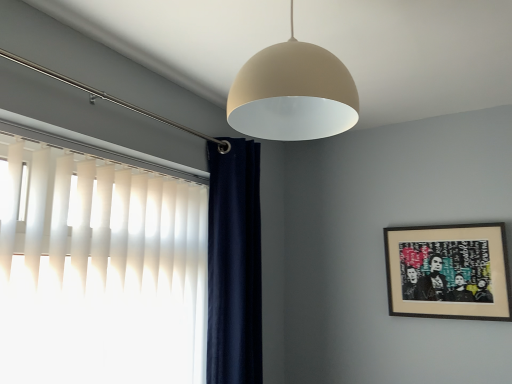
Question: Considering the relative sizes of matte beige dome at upper center and white vertical blinds at left in the image provided, is matte beige dome at upper center shorter than white vertical blinds at left?

Choices:
 (A) yes
 (B) no

Answer: (A)

Question: Is matte beige dome at upper center smaller than white vertical blinds at left?

Choices:
 (A) yes
 (B) no

Answer: (A)

Question: Can you confirm if matte beige dome at upper center is wider than white vertical blinds at left?

Choices:
 (A) no
 (B) yes

Answer: (B)

Question: Can you confirm if matte beige dome at upper center is bigger than white vertical blinds at left?

Choices:
 (A) no
 (B) yes

Answer: (A)

Question: From a real-world perspective, is matte beige dome at upper center on white vertical blinds at left?

Choices:
 (A) no
 (B) yes

Answer: (B)

Question: Are matte beige dome at upper center and white vertical blinds at left making contact?

Choices:
 (A) yes
 (B) no

Answer: (B)

Question: Is white vertical blinds at left oriented towards wooden framed artwork at right?

Choices:
 (A) no
 (B) yes

Answer: (A)

Question: Does white vertical blinds at left have a greater width compared to wooden framed artwork at right?

Choices:
 (A) yes
 (B) no

Answer: (A)

Question: Considering the relative sizes of white vertical blinds at left and wooden framed artwork at right in the image provided, is white vertical blinds at left smaller than wooden framed artwork at right?

Choices:
 (A) no
 (B) yes

Answer: (A)

Question: Is white vertical blinds at left directly adjacent to wooden framed artwork at right?

Choices:
 (A) no
 (B) yes

Answer: (A)

Question: Does white vertical blinds at left come in front of wooden framed artwork at right?

Choices:
 (A) no
 (B) yes

Answer: (B)

Question: Is white vertical blinds at left outside of wooden framed artwork at right?

Choices:
 (A) yes
 (B) no

Answer: (A)

Question: Is matte beige dome at upper center thinner than wooden framed artwork at right?

Choices:
 (A) no
 (B) yes

Answer: (A)